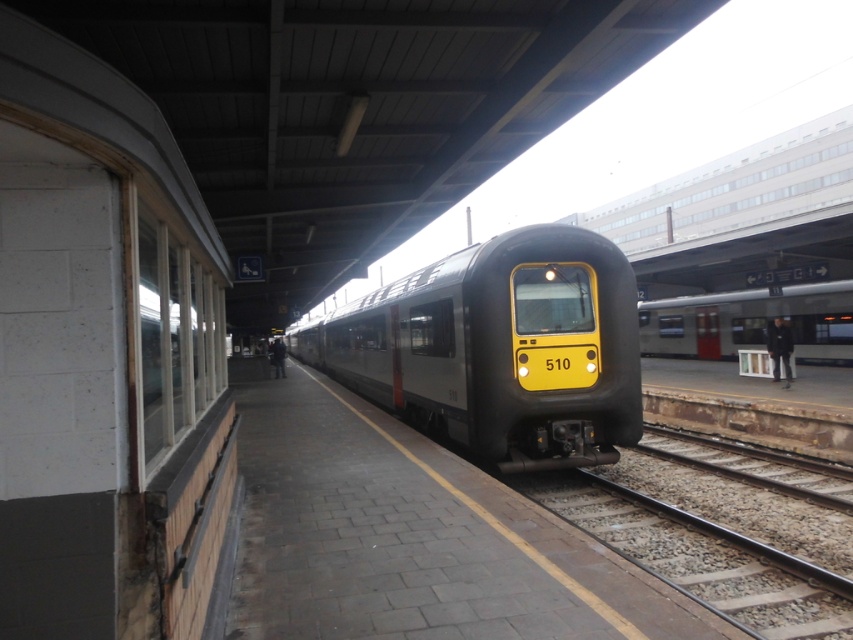
Question: Is smooth steel train track at center closer to the viewer compared to metallic silver train at center?

Choices:
 (A) yes
 (B) no

Answer: (A)

Question: Which point is closer to the camera taking this photo?

Choices:
 (A) (753, 292)
 (B) (743, 515)

Answer: (B)

Question: Considering the real-world distances, which object is closest to the metallic silver train at center?

Choices:
 (A) smooth steel train track at center
 (B) matte black train at center

Answer: (B)

Question: Can you confirm if matte black train at center is positioned to the left of metallic silver train at center?

Choices:
 (A) yes
 (B) no

Answer: (A)

Question: Which of these objects is positioned closest to the matte black train at center?

Choices:
 (A) smooth steel train track at center
 (B) metallic silver train at center

Answer: (A)

Question: Can you confirm if matte black train at center is positioned above metallic silver train at center?

Choices:
 (A) no
 (B) yes

Answer: (A)